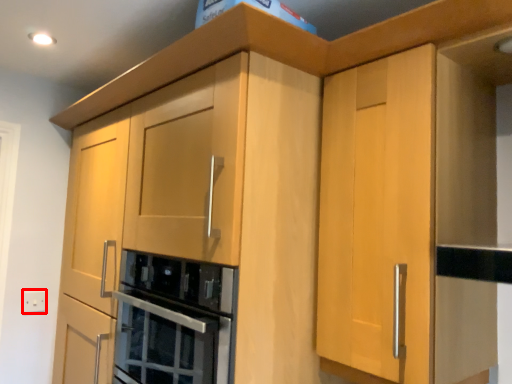
Question: From the image, what is the correct spatial relationship of electric outlet (annotated by the red box) in relation to home appliance?

Choices:
 (A) right
 (B) left

Answer: (B)